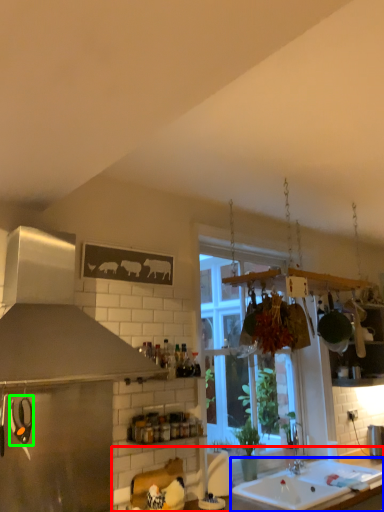
Question: Which object is the farthest from countertop (highlighted by a red box)? Choose among these: sink (highlighted by a blue box) or appliance (highlighted by a green box).

Choices:
 (A) sink
 (B) appliance

Answer: (B)